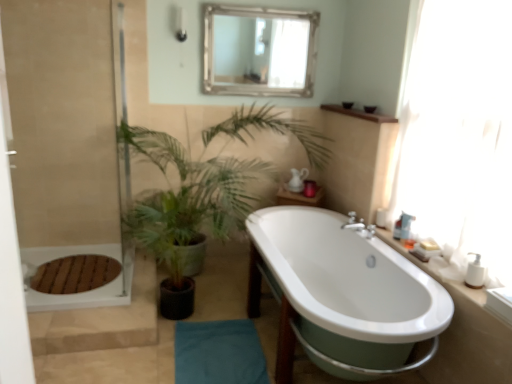
Where is `free region under beige textured screen door at left (from a real-world perspective)`? This screenshot has width=512, height=384. free region under beige textured screen door at left (from a real-world perspective) is located at coordinates (90, 297).